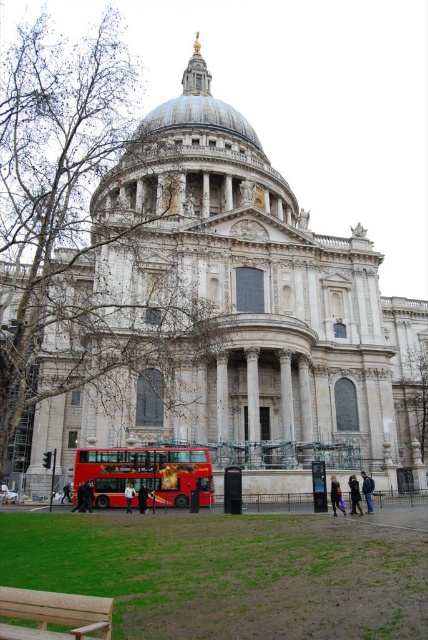
You are standing at the point with coordinates (235, 312) in the image. What significant structure are you directly facing?

You are directly facing the white stone cathedral at center located at point (235, 312).

You are a photographer planning to take a photo of St. Paul Cathedral with the dark blue jacket at lower center and dark gray coat at lower center in the frame. Since you want to focus on the cathedral, which clothing item should you move closer to the cathedral to ensure it doesn

The dark blue jacket at lower center is narrower than the dark gray coat at lower center. To focus on the cathedral, you should move the wider dark gray coat at lower center closer to the cathedral to minimize its presence in the frame.

You are a tourist standing in front of St. Paul Cathedral and you see a dark blue jacket at lower center and a dark gray coat at lower center. Which one is positioned to the right?

The dark blue jacket at lower center is positioned to the right of the dark gray coat at lower center.